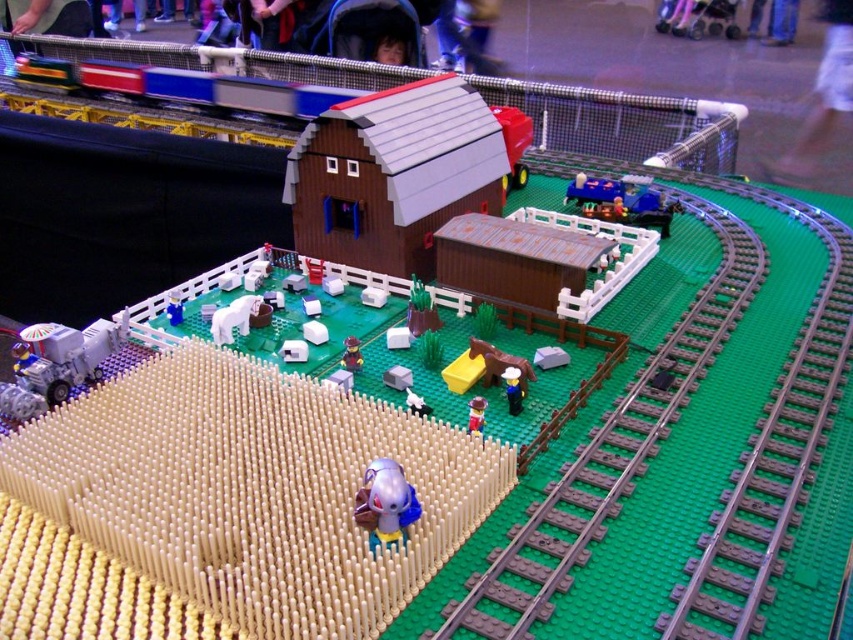
Question: Considering the relative positions of matte plastic cow at center and blue plastic figure at center in the image provided, where is matte plastic cow at center located with respect to blue plastic figure at center?

Choices:
 (A) below
 (B) above

Answer: (A)

Question: Considering the real-world distances, which object is farthest from the white matte cow at center?

Choices:
 (A) smooth plastic minifigure at center
 (B) translucent purple figure at center
 (C) smooth yellow minifigure at center

Answer: (B)

Question: Considering the real-world distances, which object is closest to the smooth plastic minifigure at center?

Choices:
 (A) blue plastic figure at center
 (B) translucent purple figure at center

Answer: (B)

Question: Among these points, which one is nearest to the camera?

Choices:
 (A) (434, 326)
 (B) (178, 296)
 (C) (480, 413)

Answer: (C)

Question: Is smooth plastic figure at center closer to camera compared to smooth plastic minifigure at center?

Choices:
 (A) no
 (B) yes

Answer: (B)

Question: Is translucent purple figure at center to the left of blue plastic figure at center from the viewer's perspective?

Choices:
 (A) no
 (B) yes

Answer: (A)